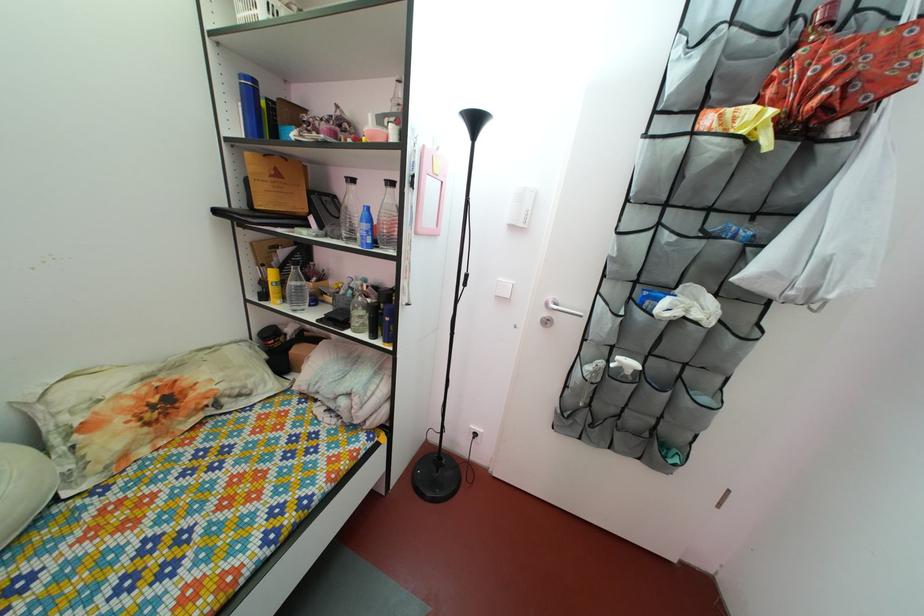
What are the coordinates of `white power outlet` in the screenshot? It's located at (476, 432).